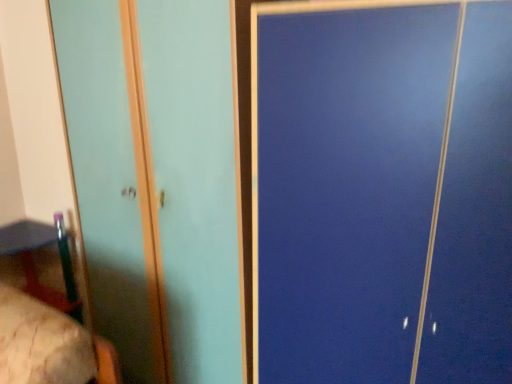
Question: Is wooden bed at lower left directly adjacent to matte teal screen door at left?

Choices:
 (A) yes
 (B) no

Answer: (B)

Question: Considering the relative sizes of wooden bed at lower left and matte teal screen door at left in the image provided, is wooden bed at lower left taller than matte teal screen door at left?

Choices:
 (A) yes
 (B) no

Answer: (B)

Question: From the image's perspective, would you say wooden bed at lower left is shown under matte teal screen door at left?

Choices:
 (A) no
 (B) yes

Answer: (B)

Question: Is wooden bed at lower left behind matte teal screen door at left?

Choices:
 (A) yes
 (B) no

Answer: (B)

Question: Is wooden bed at lower left shorter than matte teal screen door at left?

Choices:
 (A) yes
 (B) no

Answer: (A)

Question: Is wooden bed at lower left far away from matte teal screen door at left?

Choices:
 (A) no
 (B) yes

Answer: (A)

Question: Does wooden bed at lower left have a greater width compared to wooden table at lower left?

Choices:
 (A) no
 (B) yes

Answer: (A)

Question: Is wooden bed at lower left turned away from wooden table at lower left?

Choices:
 (A) yes
 (B) no

Answer: (B)

Question: Does wooden bed at lower left have a greater height compared to wooden table at lower left?

Choices:
 (A) no
 (B) yes

Answer: (A)

Question: Is wooden bed at lower left not inside wooden table at lower left?

Choices:
 (A) yes
 (B) no

Answer: (A)

Question: Is wooden bed at lower left shorter than wooden table at lower left?

Choices:
 (A) yes
 (B) no

Answer: (A)

Question: From the image's perspective, is wooden bed at lower left over wooden table at lower left?

Choices:
 (A) yes
 (B) no

Answer: (B)

Question: Can you confirm if matte teal screen door at left is positioned to the right of wooden bed at lower left?

Choices:
 (A) no
 (B) yes

Answer: (B)